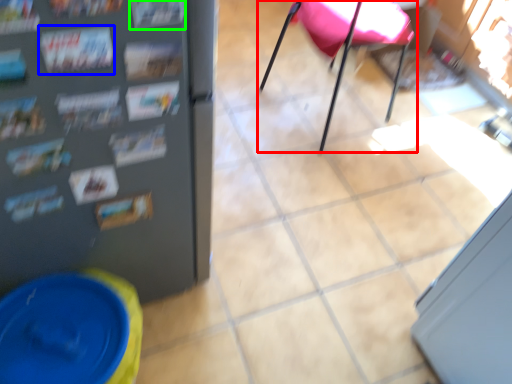
Question: Which object is positioned closest to chair (highlighted by a red box)? Select from magazine (highlighted by a blue box) and magazine (highlighted by a green box).

Choices:
 (A) magazine
 (B) magazine

Answer: (B)